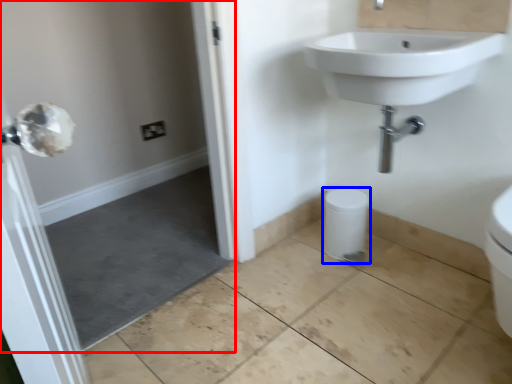
Question: Which object is closer to the camera taking this photo, screen door (highlighted by a red box) or bidet (highlighted by a blue box)?

Choices:
 (A) screen door
 (B) bidet

Answer: (A)